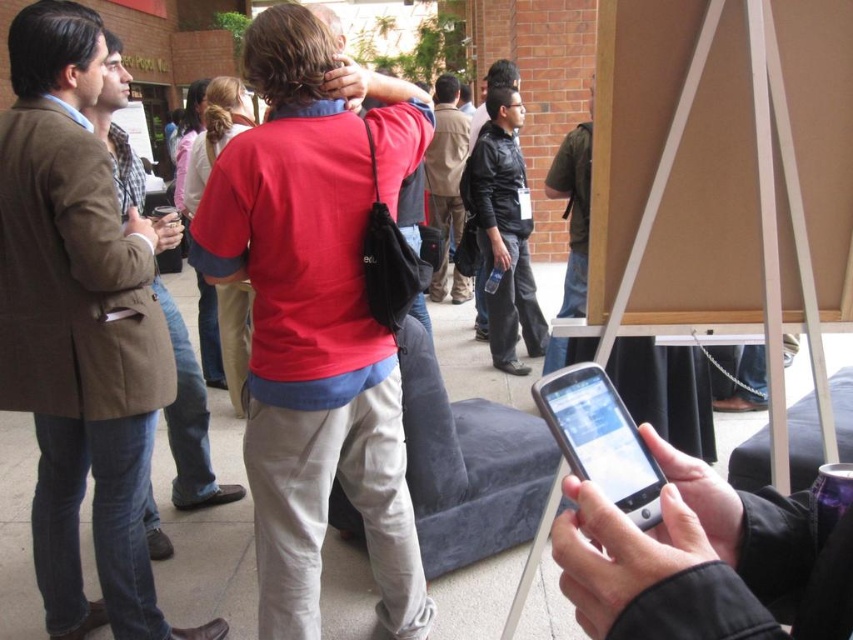
In the scene shown: Is matte red shirt at center closer to camera compared to brown wool coat at left?

Yes, it is in front of brown wool coat at left.

Between point (306, 209) and point (45, 90), which one is positioned behind?

Point (45, 90)

Identify the location of matte red shirt at center. (316, 316).

Does black leather jacket at center have a larger size compared to silver metallic smartphone at center?

Yes.

Which is more to the left, black leather jacket at center or silver metallic smartphone at center?

silver metallic smartphone at center

The image size is (853, 640). What do you see at coordinates (503, 230) in the screenshot? I see `black leather jacket at center` at bounding box center [503, 230].

You are a GUI agent. You are given a task and a screenshot of the screen. Output one action in this format:
    pyautogui.click(x=<x>, y=<y>)
    Task: Click on the black leather jacket at center
    The height and width of the screenshot is (640, 853).
    Given the screenshot: What is the action you would take?
    pyautogui.click(x=503, y=230)

Find the location of a particular element. This screenshot has height=640, width=853. brown wool coat at left is located at coordinates (79, 330).

This screenshot has width=853, height=640. What do you see at coordinates (79, 330) in the screenshot? I see `brown wool coat at left` at bounding box center [79, 330].

Image resolution: width=853 pixels, height=640 pixels. What do you see at coordinates (79, 330) in the screenshot?
I see `brown wool coat at left` at bounding box center [79, 330].

You are a GUI agent. You are given a task and a screenshot of the screen. Output one action in this format:
    pyautogui.click(x=<x>, y=<y>)
    Task: Click on the brown wool coat at left
    This screenshot has height=640, width=853.
    Given the screenshot: What is the action you would take?
    pyautogui.click(x=79, y=330)